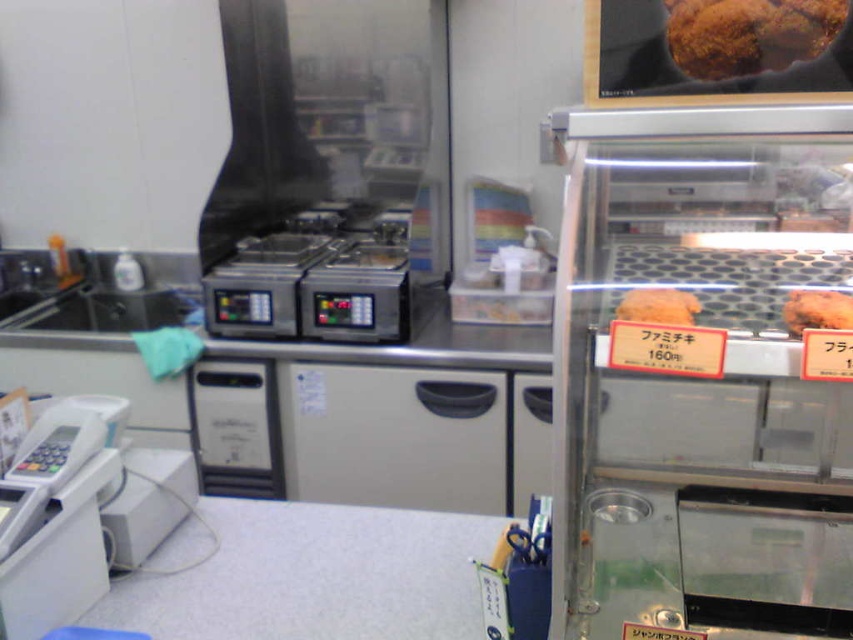
Between silver metallic vending machine at center and golden crispy bread at center, which one has more height?

With more height is silver metallic vending machine at center.

Which is in front, point (270, 429) or point (686, 316)?

Point (686, 316) is in front.

Which is behind, point (200, 387) or point (648, 298)?

Positioned behind is point (200, 387).

Where is `silver metallic vending machine at center`? The width and height of the screenshot is (853, 640). silver metallic vending machine at center is located at coordinates (236, 428).

Is silver metallic vending machine at center behind metallic silver deep fryer at center?

Yes, it is behind metallic silver deep fryer at center.

Identify the location of silver metallic vending machine at center. (236, 428).

Consider the image. Does metallic silver appliance at center appear over metallic silver deep fryer at center?

Actually, metallic silver appliance at center is below metallic silver deep fryer at center.

Is point (340, 317) behind point (292, 234)?

No, it is not.

This screenshot has width=853, height=640. I want to click on metallic silver appliance at center, so click(357, 294).